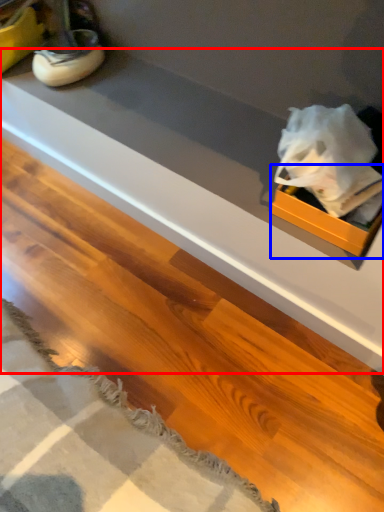
Question: Among these objects, which one is farthest to the camera, counter top (highlighted by a red box) or box (highlighted by a blue box)?

Choices:
 (A) counter top
 (B) box

Answer: (A)